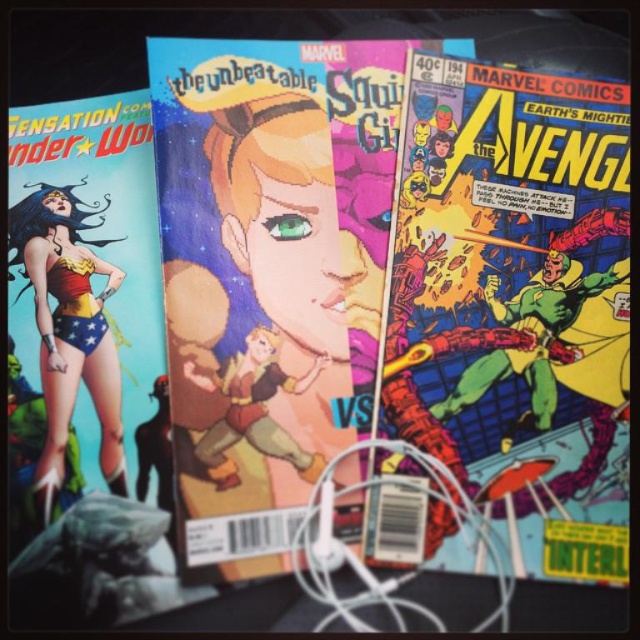
You are a photographer standing 1 meter away from the multicolored comic book at center. You want to take a photo of it using a camera that has a focal length of 50mm. Will the comic book fill the frame adequately if the camera is positioned exactly as described?

The multicolored comic book at center is 79.29 centimeters away from the camera. Since you are standing 1 meter away, which is approximately 100 centimeters, the comic book is closer than the camera position. This discrepancy means the actual distance between the camera and the comic book is about 79.29 cm. To determine if it fills the frame, consider the 50mm focal length. At 79.29 cm, the 50mm lens would capture a field of view that might not fully encompass the comic book unless it is relatively large. A

You are organizing a comic book display and need to ensure that the multicolored comic book at center and the shiny red and gold costume at left are visible to visitors. Given their sizes, which one should be placed higher on the shelf to ensure both are easily seen?

The multicolored comic book at center is larger in size than the shiny red and gold costume at left, so placing the larger comic book at center lower on the shelf and the smaller shiny red and gold costume at left higher up will ensure both are visible without one blocking the other.